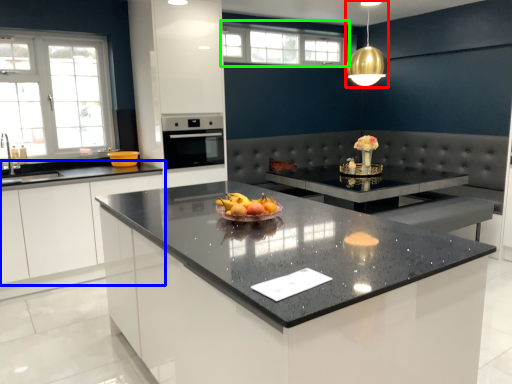
Question: Estimate the real-world distances between objects in this image. Which object is farther from light fixture (highlighted by a red box), cabinetry (highlighted by a blue box) or window (highlighted by a green box)?

Choices:
 (A) cabinetry
 (B) window

Answer: (A)